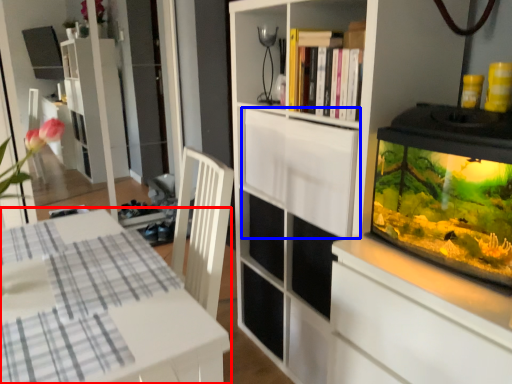
Question: Which of the following is the farthest to the observer, table (highlighted by a red box) or cabinetry (highlighted by a blue box)?

Choices:
 (A) table
 (B) cabinetry

Answer: (B)